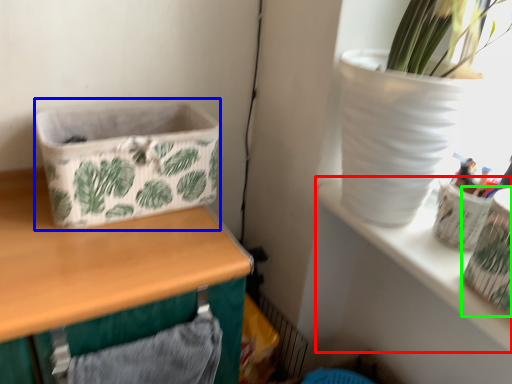
Question: Considering the real-world distances, which object is farthest from shelf (highlighted by a red box)? basket container (highlighted by a blue box) or vase (highlighted by a green box)?

Choices:
 (A) basket container
 (B) vase

Answer: (A)